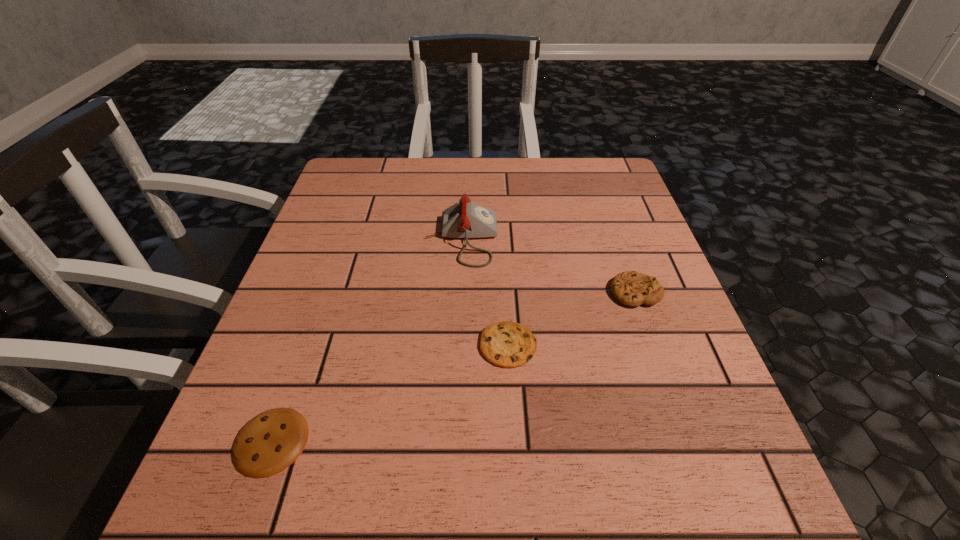
I want to click on vacant area that satisfies the following two spatial constraints: 1. on the dial of the second cookie from left to right; 2. on the left side of the tallest object, so click(457, 345).

Locate an element on the screen. The height and width of the screenshot is (540, 960). free space that satisfies the following two spatial constraints: 1. on the dial of the third shortest object; 2. on the right side of the telephone is located at coordinates (459, 292).